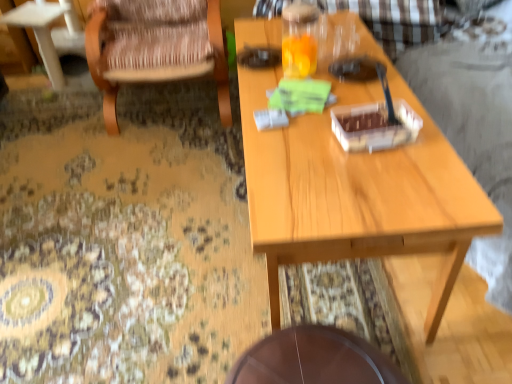
Measure the distance between brown wooden table at lower center and camera.

brown wooden table at lower center is 37.97 inches from camera.

Measure the distance between wooden woven chair at left and camera.

wooden woven chair at left is 1.96 meters from camera.

This screenshot has height=384, width=512. Describe the element at coordinates (155, 47) in the screenshot. I see `wooden woven chair at left` at that location.

The height and width of the screenshot is (384, 512). In order to click on wooden coffee table at left in this screenshot , I will do 50,33.

This screenshot has width=512, height=384. What are the coordinates of `light wood table at center` in the screenshot? It's located at (357, 188).

Based on the photo, considering the positions of objects wooden woven chair at left and light wood table at center in the image provided, who is more to the left, wooden woven chair at left or light wood table at center?

wooden woven chair at left.

Can you confirm if wooden woven chair at left is shorter than light wood table at center?

In fact, wooden woven chair at left may be taller than light wood table at center.

Can you tell me how much wooden woven chair at left and light wood table at center differ in facing direction?

The facing directions of wooden woven chair at left and light wood table at center are 90.1 degrees apart.

At what (x,y) coordinates should I click in order to perform the action: click on table below the wooden coffee table at left (from a real-world perspective). Please return your answer as a coordinate pair (x, y). Image resolution: width=512 pixels, height=384 pixels. Looking at the image, I should click on (357, 188).

Which object is further away from the camera taking this photo, light wood table at center or wooden coffee table at left?

wooden coffee table at left is further away from the camera.

Is light wood table at center aimed at wooden coffee table at left?

No, light wood table at center is not oriented towards wooden coffee table at left.

From a real-world perspective, is light wood table at center under wooden coffee table at left?

Correct, in the physical world, light wood table at center is lower than wooden coffee table at left.

Would you say light wood table at center contains brown wooden table at lower center?

Actually, brown wooden table at lower center is outside light wood table at center.

Are light wood table at center and brown wooden table at lower center located far from each other?

No, light wood table at center is not far from brown wooden table at lower center.

Considering the relative positions of light wood table at center and brown wooden table at lower center in the image provided, is light wood table at center behind brown wooden table at lower center?

No, light wood table at center is closer to the viewer.

Would you say wooden coffee table at left is a long distance from wooden woven chair at left?

wooden coffee table at left is actually quite close to wooden woven chair at left.

Is wooden coffee table at left oriented towards wooden woven chair at left?

No, wooden coffee table at left is not facing towards wooden woven chair at left.

Does wooden coffee table at left appear on the right side of wooden woven chair at left?

Incorrect, wooden coffee table at left is not on the right side of wooden woven chair at left.

Consider the image. From a real-world perspective, is wooden woven chair at left located higher than brown wooden table at lower center?

Correct, in the physical world, wooden woven chair at left is higher than brown wooden table at lower center.

Can you tell me how much wooden woven chair at left and brown wooden table at lower center differ in facing direction?

There is a 88.9-degree angle between the facing directions of wooden woven chair at left and brown wooden table at lower center.

Does point (96, 31) come closer to viewer compared to point (308, 342)?

No, (96, 31) is further to viewer.

Between wooden woven chair at left and brown wooden table at lower center, which one is positioned behind?

Positioned behind is wooden woven chair at left.

Which is closer to the camera, (486, 215) or (120, 42)?

Point (486, 215).

From the picture: From the image's perspective, would you say light wood table at center is shown under wooden woven chair at left?

Correct, light wood table at center appears lower than wooden woven chair at left in the image.

From a real-world perspective, is light wood table at center positioned above or below wooden woven chair at left?

light wood table at center is situated lower than wooden woven chair at left in the real world.

Who is smaller, light wood table at center or wooden woven chair at left?

With smaller size is light wood table at center.

From the image's perspective, is wooden woven chair at left on wooden coffee table at left?

No, from the image's perspective, wooden woven chair at left is not above wooden coffee table at left.

Is wooden woven chair at left positioned behind wooden coffee table at left?

No, it is not.

Is wooden woven chair at left touching wooden coffee table at left?

There is a gap between wooden woven chair at left and wooden coffee table at left.

Where is `chair behind the light wood table at center`? The width and height of the screenshot is (512, 384). chair behind the light wood table at center is located at coordinates (155, 47).

Identify the location of table in front of the wooden coffee table at left. (357, 188).

Estimate the real-world distances between objects in this image. Which object is further from wooden woven chair at left, light wood table at center or brown wooden table at lower center?

brown wooden table at lower center lies further to wooden woven chair at left than the other object.

Based on the photo, when comparing their distances from wooden woven chair at left, does light wood table at center or wooden coffee table at left seem further?

light wood table at center is further to wooden woven chair at left.

Based on their spatial positions, is brown wooden table at lower center or light wood table at center further from wooden woven chair at left?

brown wooden table at lower center is positioned further to the anchor wooden woven chair at left.

Based on their spatial positions, is brown wooden table at lower center or wooden woven chair at left further from wooden coffee table at left?

brown wooden table at lower center is further to wooden coffee table at left.

Looking at the image, which one is located closer to brown wooden table at lower center, wooden woven chair at left or light wood table at center?

Based on the image, light wood table at center appears to be nearer to brown wooden table at lower center.

From the image, which object appears to be farther from wooden coffee table at left, light wood table at center or brown wooden table at lower center?

brown wooden table at lower center.

Considering their positions, is wooden woven chair at left positioned closer to light wood table at center than wooden coffee table at left?

Among the two, wooden woven chair at left is located nearer to light wood table at center.

Based on their spatial positions, is wooden coffee table at left or light wood table at center further from brown wooden table at lower center?

wooden coffee table at left.

Identify the location of round table located between wooden coffee table at left and light wood table at center in the left-right direction. The height and width of the screenshot is (384, 512). (313, 359).

Locate an element on the screen. Image resolution: width=512 pixels, height=384 pixels. chair situated between wooden coffee table at left and light wood table at center from left to right is located at coordinates (155, 47).

The height and width of the screenshot is (384, 512). What are the coordinates of `table between wooden woven chair at left and brown wooden table at lower center in the up-down direction` in the screenshot? It's located at (357, 188).

Image resolution: width=512 pixels, height=384 pixels. In order to click on chair between wooden coffee table at left and brown wooden table at lower center in the up-down direction in this screenshot , I will do `click(155, 47)`.